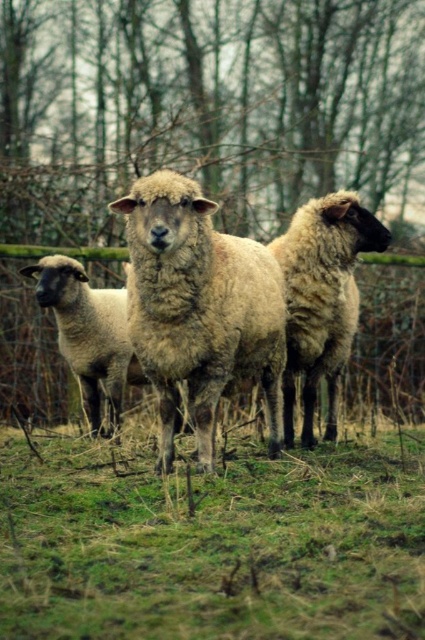
From the picture: Does fuzzy woolen sheep at center have a lesser height compared to brown woolen sheep at center?

Yes.

Is fuzzy woolen sheep at center bigger than brown woolen sheep at center?

Yes, fuzzy woolen sheep at center is bigger than brown woolen sheep at center.

Which is behind, point (195, 253) or point (314, 387)?

The point (314, 387) is more distant.

What are the coordinates of `fuzzy woolen sheep at center` in the screenshot? It's located at (200, 308).

Can you confirm if brown woolen sheep at center is positioned above light brown woolly sheep at center?

Actually, brown woolen sheep at center is below light brown woolly sheep at center.

In the scene shown: Does brown woolen sheep at center have a greater width compared to light brown woolly sheep at center?

Incorrect, brown woolen sheep at center's width does not surpass light brown woolly sheep at center's.

Where is `brown woolen sheep at center`? This screenshot has height=640, width=425. brown woolen sheep at center is located at coordinates (322, 298).

Between fuzzy woolen sheep at center and light brown woolly sheep at center, which one appears on the left side from the viewer's perspective?

light brown woolly sheep at center is more to the left.

Which is behind, point (282, 317) or point (76, 284)?

The point (76, 284) is behind.

Identify the location of fuzzy woolen sheep at center. The height and width of the screenshot is (640, 425). (200, 308).